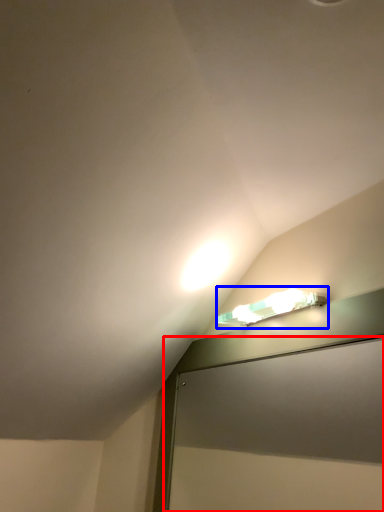
Question: Among these objects, which one is farthest to the camera, screen door (highlighted by a red box) or lamp (highlighted by a blue box)?

Choices:
 (A) screen door
 (B) lamp

Answer: (B)